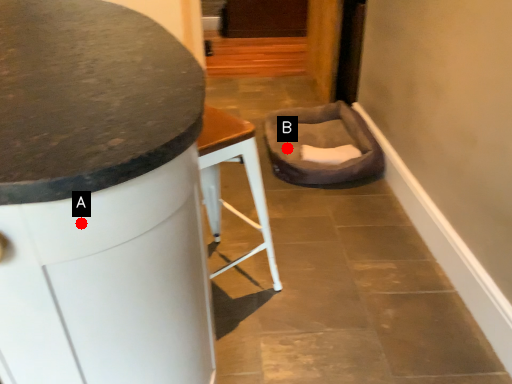
Question: Two points are circled on the image, labeled by A and B beside each circle. Which point is farther from the camera taking this photo?

Choices:
 (A) A is further
 (B) B is further

Answer: (B)